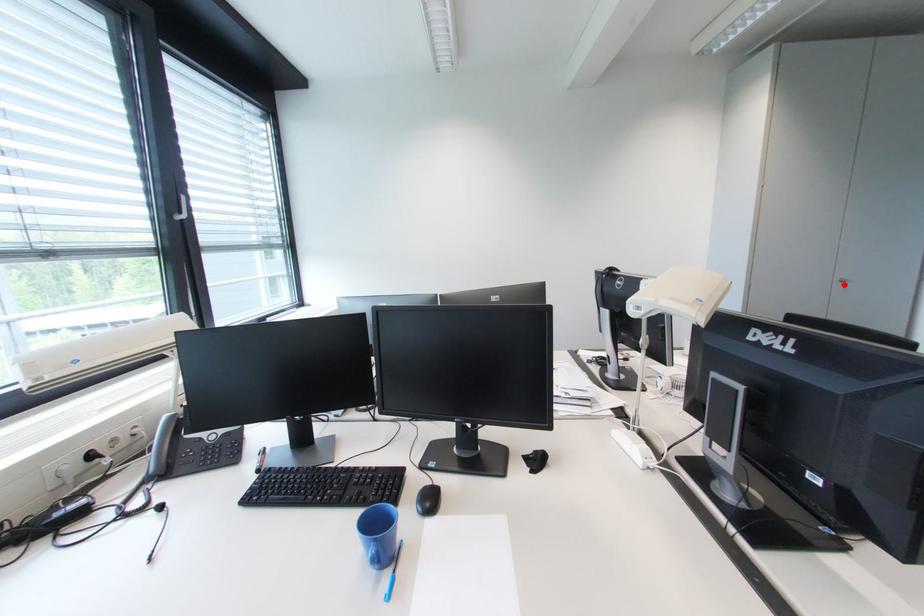
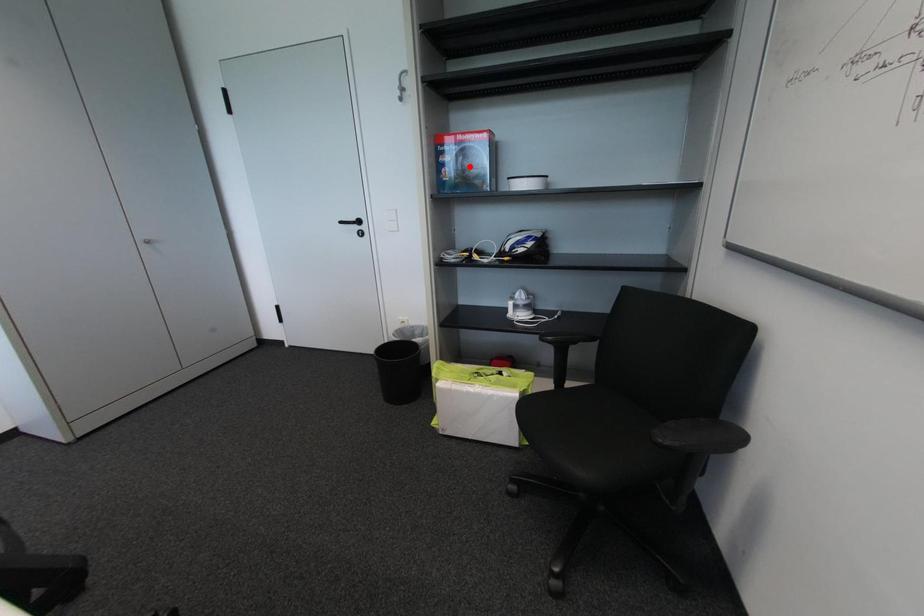
I am providing you with two images of the same scene from different viewpoints. A red point is marked on the first image and another point is marked on the second image. Is the red point in image1 aligned with the point shown in image2?

No